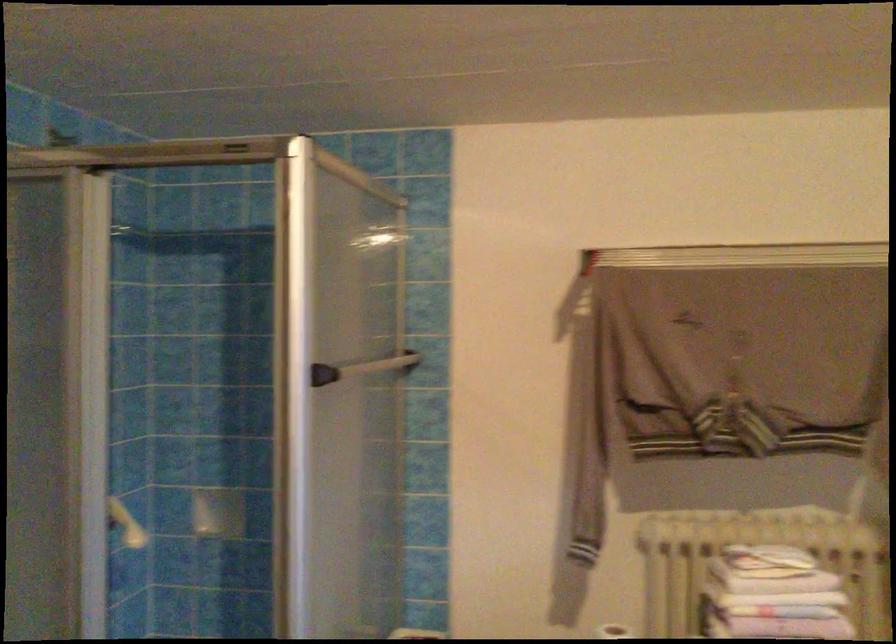
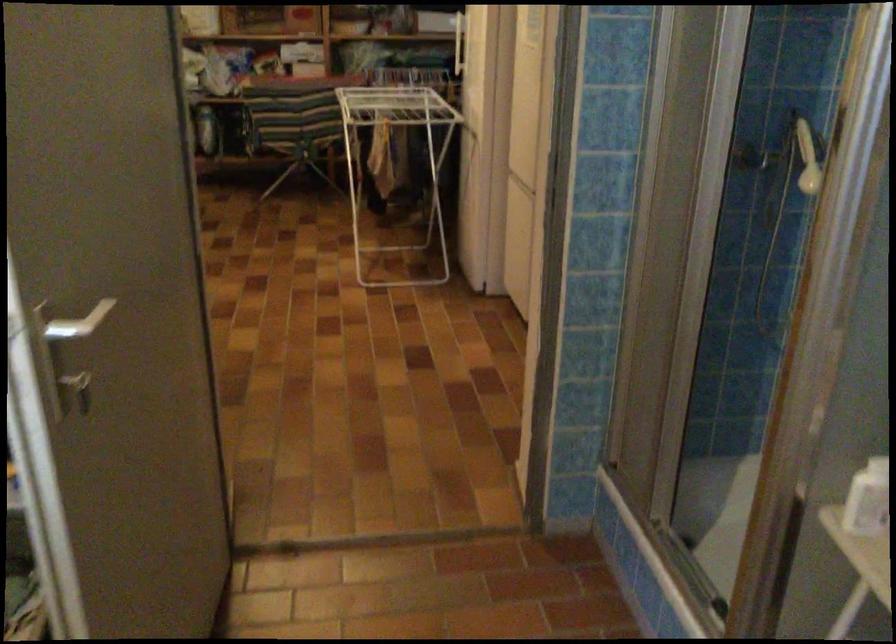
First-person continuous shooting, in which direction is the camera rotating?

The camera rotated toward left-down.